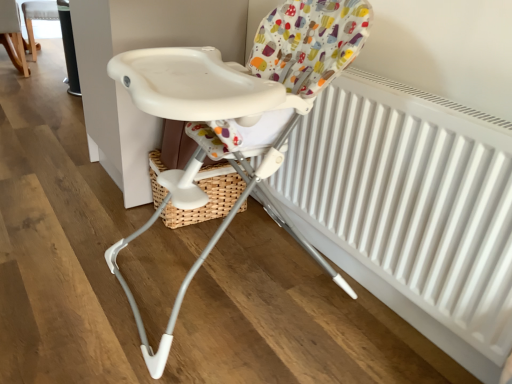
Question: Is white plastic chair at upper left, the third chair viewed from the right, wider or thinner than white matte radiator at center?

Choices:
 (A) thin
 (B) wide

Answer: (B)

Question: Is white plastic chair at upper left, the first chair viewed from the left, taller or shorter than white matte radiator at center?

Choices:
 (A) tall
 (B) short

Answer: (B)

Question: Considering the real-world distances, which object is closest to the white plastic highchair at upper center, placed as the second chair when sorted from left to right?

Choices:
 (A) white plastic highchair at center, which ranks as the 1th chair in front-to-back order
 (B) white matte radiator at center
 (C) white plastic chair at upper left, placed as the second chair when sorted from front to back

Answer: (C)

Question: Estimate the real-world distances between objects in this image. Which object is farther from the white plastic chair at upper left, the first chair viewed from the left?

Choices:
 (A) white plastic highchair at center, marked as the 3th chair in a left-to-right arrangement
 (B) white matte radiator at center
 (C) white plastic highchair at upper center, placed as the 2th chair when sorted from right to left

Answer: (B)